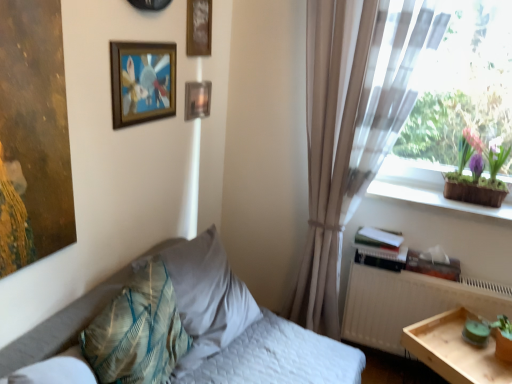
This screenshot has width=512, height=384. I want to click on free space in front of purple clay pot at window, so click(x=482, y=211).